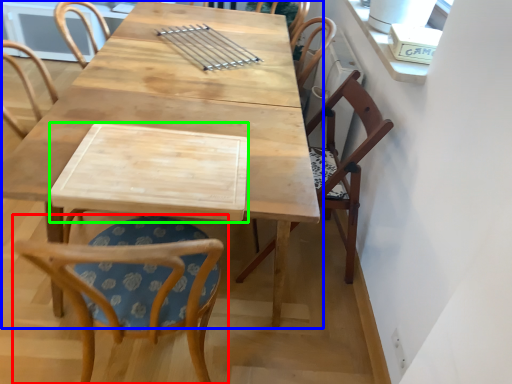
Question: Which object is positioned farthest from chair (highlighted by a red box)? Select from table (highlighted by a blue box) and plank (highlighted by a green box).

Choices:
 (A) table
 (B) plank

Answer: (A)